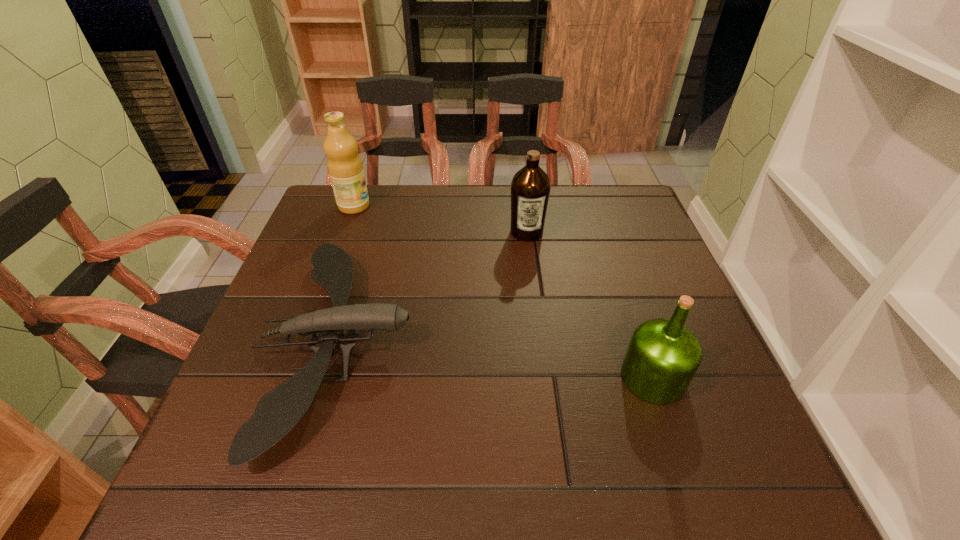
Find the location of a particular element. free space in the image that satisfies the following two spatial constraints: 1. on the back side of the rightmost object; 2. at the head of the drone is located at coordinates (641, 343).

Where is `vacant area that satisfies the following two spatial constraints: 1. on the label of the second object from right to left; 2. on the right side of the rightmost object`? Image resolution: width=960 pixels, height=540 pixels. vacant area that satisfies the following two spatial constraints: 1. on the label of the second object from right to left; 2. on the right side of the rightmost object is located at coordinates (545, 377).

Image resolution: width=960 pixels, height=540 pixels. Identify the location of vacant space that satisfies the following two spatial constraints: 1. on the label of the rightmost olive oil; 2. on the left side of the farthest olive oil. (291, 377).